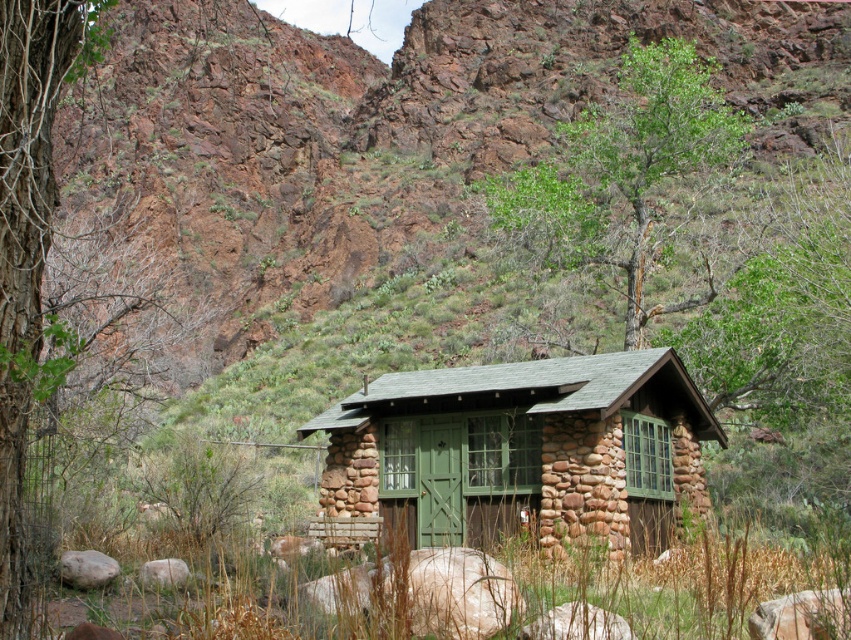
Is green grass at center bigger than smooth bark tree at left?

Correct, green grass at center is larger in size than smooth bark tree at left.

Is green grass at center smaller than smooth bark tree at left?

Incorrect, green grass at center is not smaller in size than smooth bark tree at left.

Between point (175, 630) and point (47, 93), which one is positioned behind?

Positioned behind is point (175, 630).

Image resolution: width=851 pixels, height=640 pixels. What are the coordinates of `green grass at center` in the screenshot? It's located at (620, 589).

Is green stone cabin at center shorter than green grass at center?

Incorrect, green stone cabin at center's height does not fall short of green grass at center's.

Does green stone cabin at center appear over green grass at center?

Yes.

Identify the location of green stone cabin at center. (521, 451).

Locate an element on the screen. This screenshot has height=640, width=851. green stone cabin at center is located at coordinates [521, 451].

Measure the distance between green stone cabin at center and green leafy tree at upper center.

green stone cabin at center is 18.50 meters away from green leafy tree at upper center.

Is point (694, 422) less distant than point (527, 189)?

That is True.

Where is `green stone cabin at center`? green stone cabin at center is located at coordinates (521, 451).